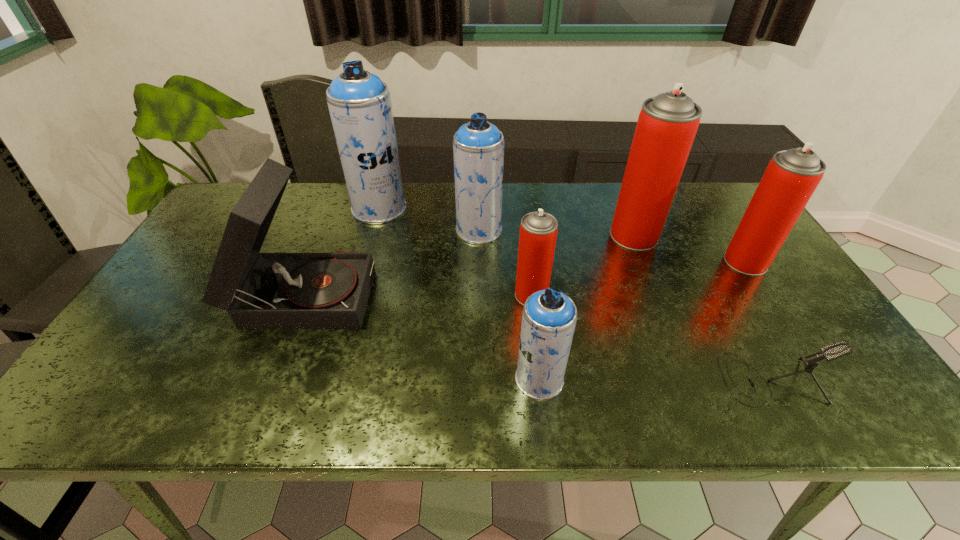
Point out which blue aerosol can is positioned as the nearest to the second red aerosol can from left to right. Please provide its 2D coordinates. Your answer should be formatted as a tuple, i.e. [(x, y)], where the tuple contains the x and y coordinates of a point satisfying the conditions above.

[(478, 146)]

Where is `free space that satisfies the following two spatial constraints: 1. on the front side of the second smallest red aerosol can; 2. on the stand of the microphone`? The height and width of the screenshot is (540, 960). free space that satisfies the following two spatial constraints: 1. on the front side of the second smallest red aerosol can; 2. on the stand of the microphone is located at coordinates (821, 379).

Locate an element on the screen. The image size is (960, 540). blank area in the image that satisfies the following two spatial constraints: 1. on the front-facing side of the phonograph_record; 2. on the right side of the smallest blue aerosol can is located at coordinates (271, 379).